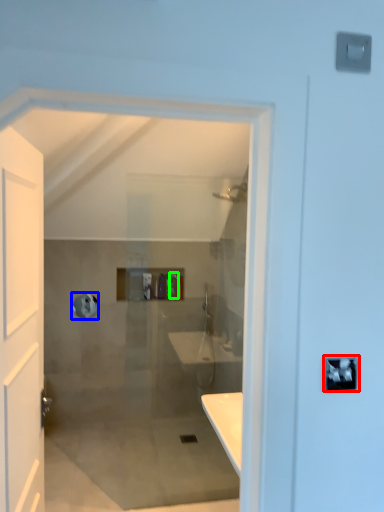
Question: Based on their relative distances, which object is nearer to lock (highlighted by a red box)? Choose from towel bar (highlighted by a blue box) and toiletry (highlighted by a green box).

Choices:
 (A) towel bar
 (B) toiletry

Answer: (B)